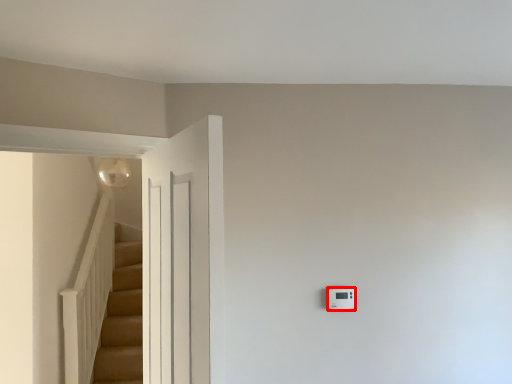
Question: From the image's perspective, what is the correct spatial relationship of light switch (annotated by the red box) in relation to door?

Choices:
 (A) above
 (B) below

Answer: (B)